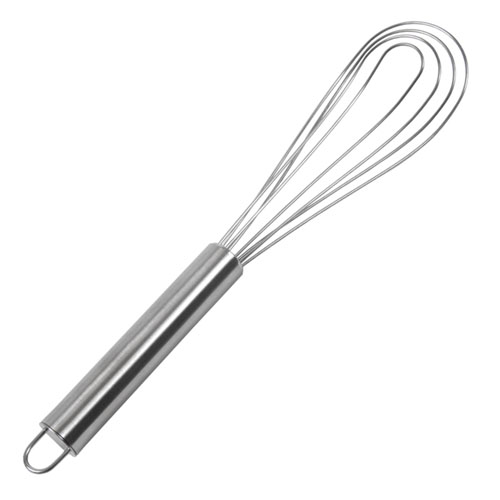
Find the location of a particular element. The width and height of the screenshot is (500, 500). top of whisk (mixing side) is located at coordinates [448, 33].